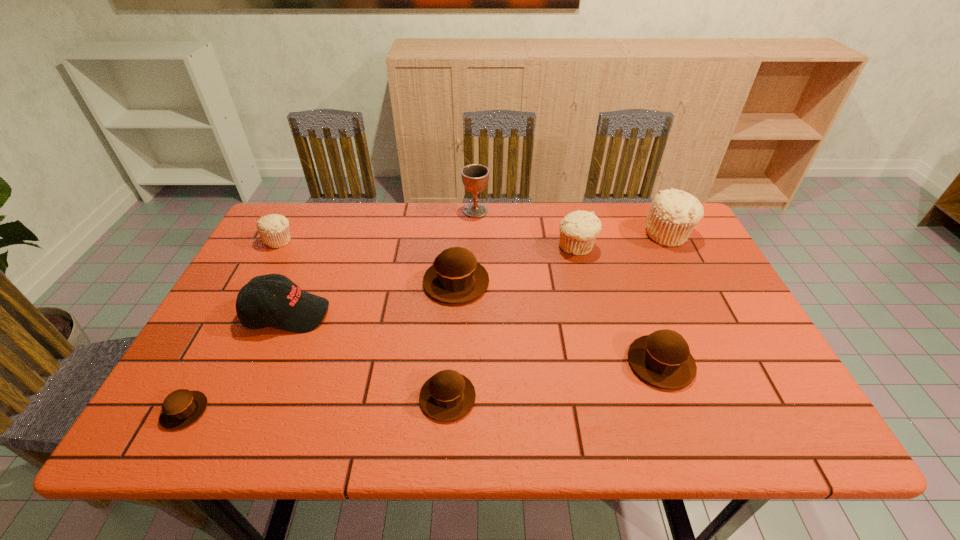
Locate an element on the screen. The height and width of the screenshot is (540, 960). free space located on the right of the rightmost brown muffin is located at coordinates (720, 363).

The height and width of the screenshot is (540, 960). I want to click on vacant space situated on the back of the second shortest object, so click(455, 284).

Identify the location of free space located on the right of the shortest object. (379, 411).

This screenshot has height=540, width=960. I want to click on chalice that is at the far edge, so click(475, 177).

Identify the location of baseball cap that is at the left edge. The height and width of the screenshot is (540, 960). (292, 309).

The width and height of the screenshot is (960, 540). Identify the location of object present at the right edge. (673, 214).

You are a GUI agent. You are given a task and a screenshot of the screen. Output one action in this format:
    pyautogui.click(x=<x>, y=<y>)
    Task: Click on the object that is at the far left corner
    This screenshot has height=540, width=960.
    Given the screenshot: What is the action you would take?
    pyautogui.click(x=274, y=229)

This screenshot has width=960, height=540. In order to click on object that is positioned at the near left corner in this screenshot , I will do `click(181, 408)`.

At what (x,y) coordinates should I click in order to perform the action: click on object at the far right corner. Please return your answer as a coordinate pair (x, y). The image size is (960, 540). Looking at the image, I should click on (673, 214).

Locate an element on the screen. vacant region at the far edge of the desktop is located at coordinates (338, 204).